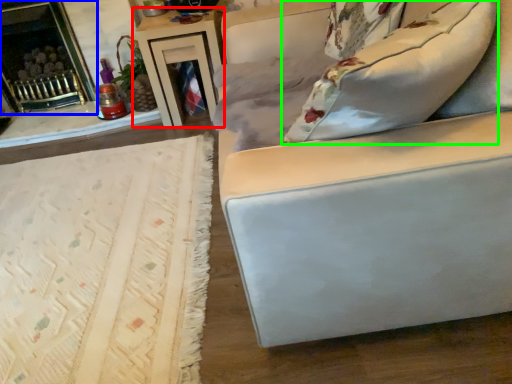
Question: Which object is positioned farthest from table (highlighted by a red box)? Select from fireplace (highlighted by a blue box) and pillow (highlighted by a green box).

Choices:
 (A) fireplace
 (B) pillow

Answer: (B)